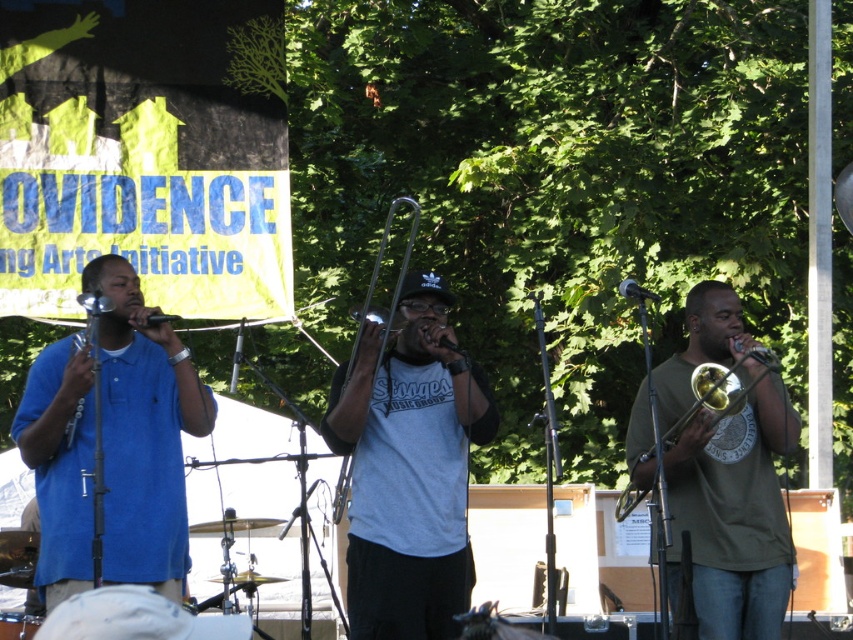
You are a photographer at the event and want to capture the entire band in a single shot. The band members are positioned at different points on the stage. You notice a point marked at coordinates (144, 433) on your camera screen. What object is located at that point?

The point at coordinates (144, 433) marks the matte blue shirt at left.